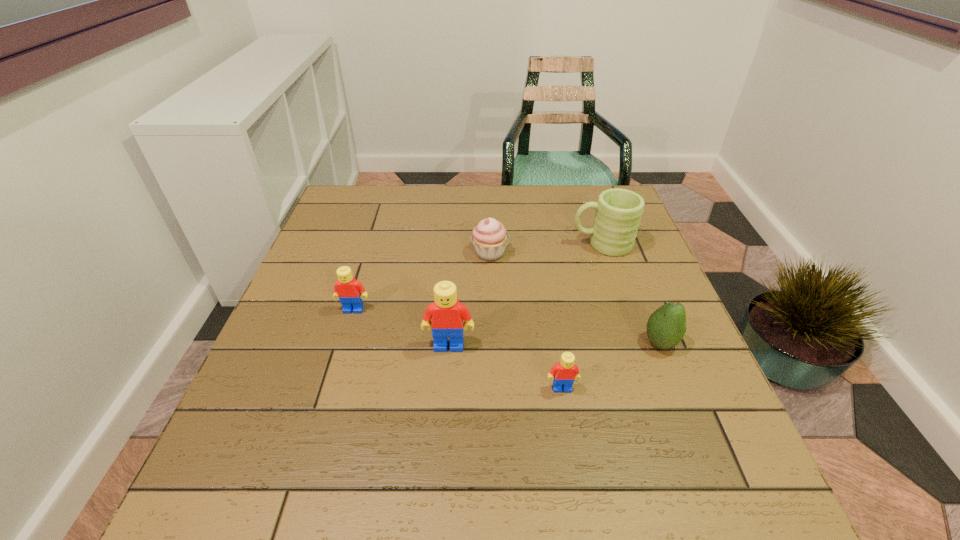
The width and height of the screenshot is (960, 540). In the image, there is a desktop. Identify the location of vacant space at the far edge. (426, 226).

Identify the location of free space at the near edge. (569, 449).

Where is `vacant region at the left edge of the desktop`? The height and width of the screenshot is (540, 960). vacant region at the left edge of the desktop is located at coordinates (347, 230).

Locate an element on the screen. free space at the right edge is located at coordinates (649, 374).

The image size is (960, 540). Find the location of `free point at the far left corner`. free point at the far left corner is located at coordinates (364, 223).

I want to click on vacant space that is in between the rightmost Lego and the mug, so click(x=582, y=316).

At what (x,y) coordinates should I click in order to perform the action: click on vacant space that's between the avocado and the farthest Lego. Please return your answer as a coordinate pair (x, y). The height and width of the screenshot is (540, 960). Looking at the image, I should click on (507, 326).

This screenshot has height=540, width=960. What are the coordinates of `unoccupied position between the mug and the leftmost object` in the screenshot? It's located at (477, 277).

Find the location of a particular element. The image size is (960, 540). vacant space that's between the tallest Lego and the nearest object is located at coordinates (506, 367).

The height and width of the screenshot is (540, 960). Find the location of `free space between the mug and the avocado`. free space between the mug and the avocado is located at coordinates (631, 294).